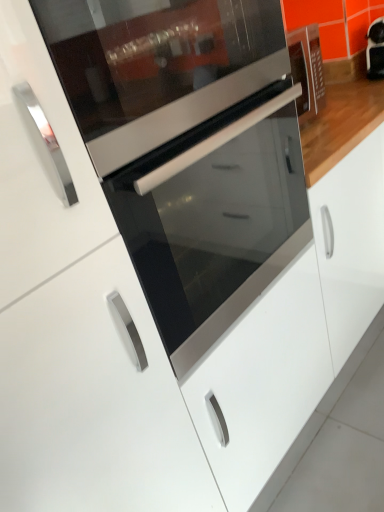
Question: Considering their positions, is matte black oven at center located in front of or behind glossy white cabinet at center?

Choices:
 (A) front
 (B) behind

Answer: (A)

Question: From their relative heights in the image, would you say matte black oven at center is taller or shorter than glossy white cabinet at center?

Choices:
 (A) tall
 (B) short

Answer: (B)

Question: Estimate the real-world distances between objects in this image. Which object is farther from the glossy white cabinet at center?

Choices:
 (A) matte black oven at center
 (B) satin silver oven at center

Answer: (B)

Question: Which object is positioned closest to the matte black oven at center?

Choices:
 (A) satin silver oven at center
 (B) glossy white cabinet at center

Answer: (A)